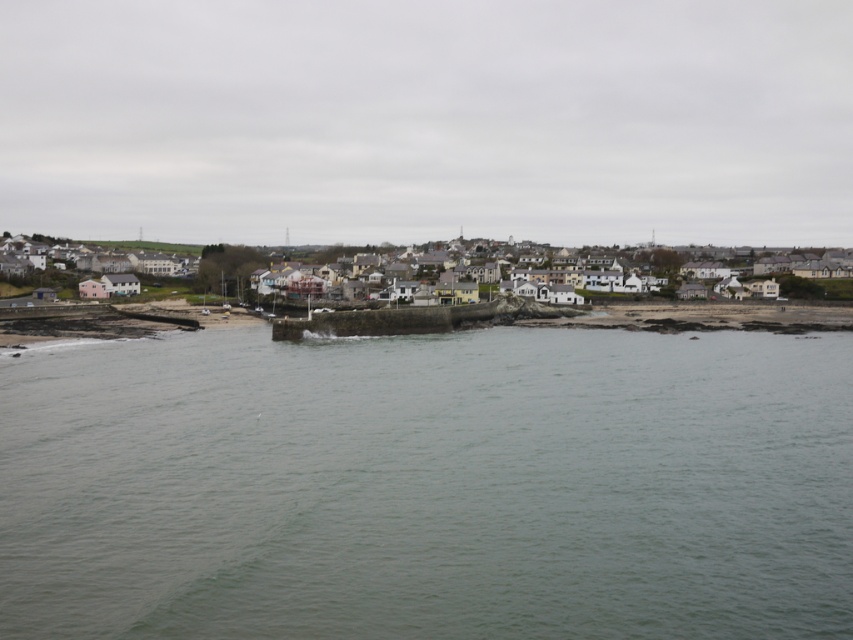
Question: Among these objects, which one is nearest to the camera?

Choices:
 (A) greenish-gray water at center
 (B) white matte houses at center

Answer: (A)

Question: Which of the following is the farthest from the observer?

Choices:
 (A) (90, 413)
 (B) (660, 268)

Answer: (B)

Question: Does greenish-gray water at center have a smaller size compared to white matte houses at center?

Choices:
 (A) no
 (B) yes

Answer: (B)

Question: Is greenish-gray water at center further to the viewer compared to white matte houses at center?

Choices:
 (A) yes
 (B) no

Answer: (B)

Question: Does greenish-gray water at center lie in front of white matte houses at center?

Choices:
 (A) no
 (B) yes

Answer: (B)